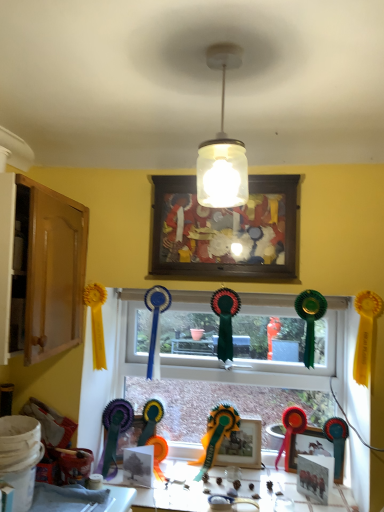
Find the location of a particular element. blank space situated above wooden picture frame at center, which is the first picture frame from front to back (from a real-world perspective) is located at coordinates (247, 175).